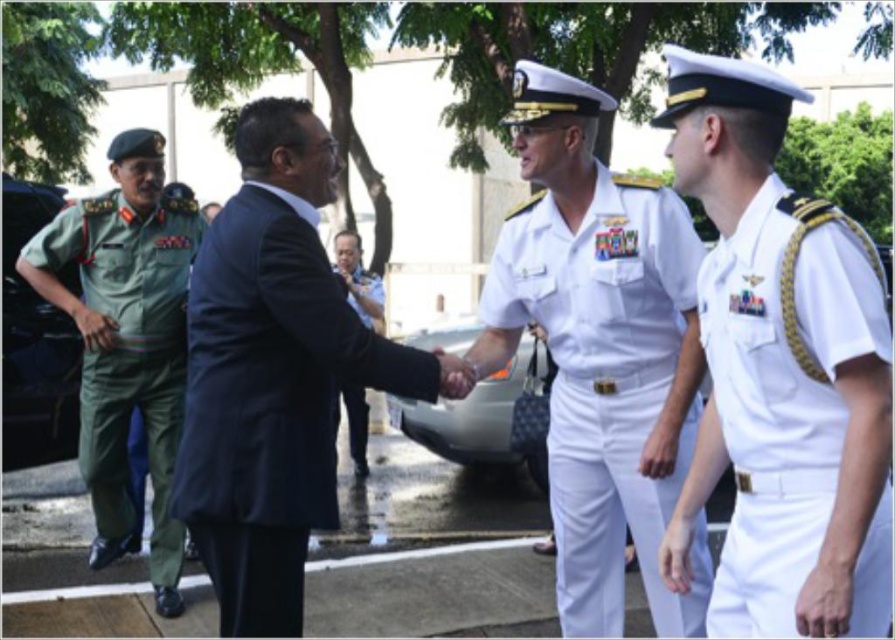
Can you confirm if white cotton uniform at center is positioned to the right of dark blue suit at center?

Indeed, white cotton uniform at center is positioned on the right side of dark blue suit at center.

Between point (585, 260) and point (346, 397), which one is positioned in front?

Positioned in front is point (585, 260).

What do you see at coordinates (606, 381) in the screenshot? This screenshot has width=895, height=640. I see `white cotton uniform at center` at bounding box center [606, 381].

Locate an element on the screen. white cotton uniform at center is located at coordinates (606, 381).

Is point (253, 394) closer to viewer compared to point (365, 284)?

Yes.

Between navy blue fabric suit at center and dark blue suit at center, which one has more height?

With more height is navy blue fabric suit at center.

At what (x,y) coordinates should I click in order to perform the action: click on navy blue fabric suit at center. Please return your answer as a coordinate pair (x, y). This screenshot has width=895, height=640. Looking at the image, I should click on (270, 403).

Consider the image. Can you confirm if white cotton uniform at center is positioned below white cotton shirt at right?

Yes.

Which is more to the left, white cotton uniform at center or white cotton shirt at right?

white cotton uniform at center is more to the left.

Does point (556, 301) come farther from viewer compared to point (859, 326)?

Yes, point (556, 301) is behind point (859, 326).

Image resolution: width=895 pixels, height=640 pixels. What are the coordinates of `white cotton uniform at center` in the screenshot? It's located at (606, 381).